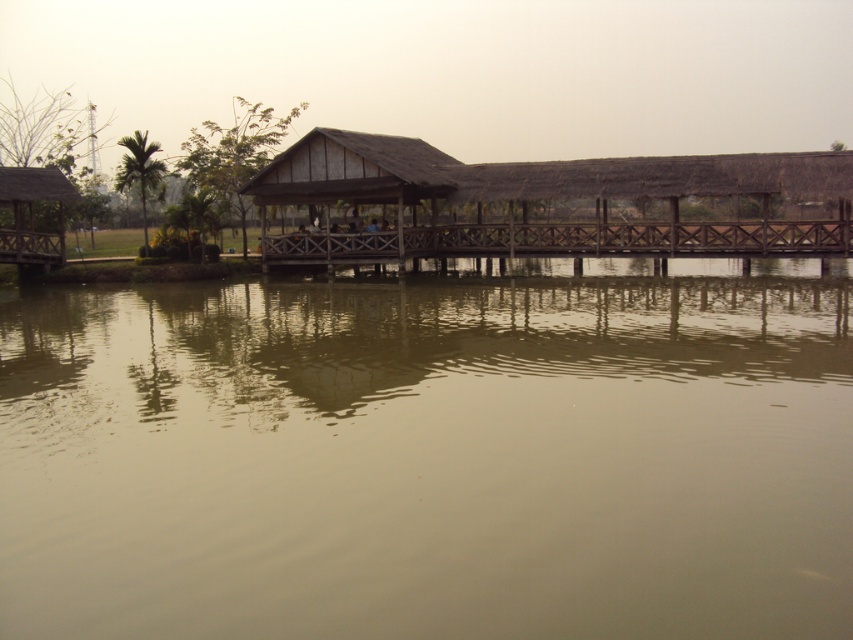
Question: Which point is closer to the camera?

Choices:
 (A) brown murky water at center
 (B) wooden thatched hut at center

Answer: (A)

Question: Can you confirm if brown murky water at center is positioned to the right of brown wooden dock at center?

Choices:
 (A) no
 (B) yes

Answer: (A)

Question: Can you confirm if brown wooden dock at center is wider than wooden hut at left?

Choices:
 (A) yes
 (B) no

Answer: (A)

Question: Is brown wooden dock at center behind wooden hut at left?

Choices:
 (A) yes
 (B) no

Answer: (B)

Question: Among these objects, which one is nearest to the camera?

Choices:
 (A) wooden thatched hut at center
 (B) wooden hut at left
 (C) brown murky water at center

Answer: (C)

Question: Which object is farther from the camera taking this photo?

Choices:
 (A) wooden hut at left
 (B) brown murky water at center

Answer: (A)